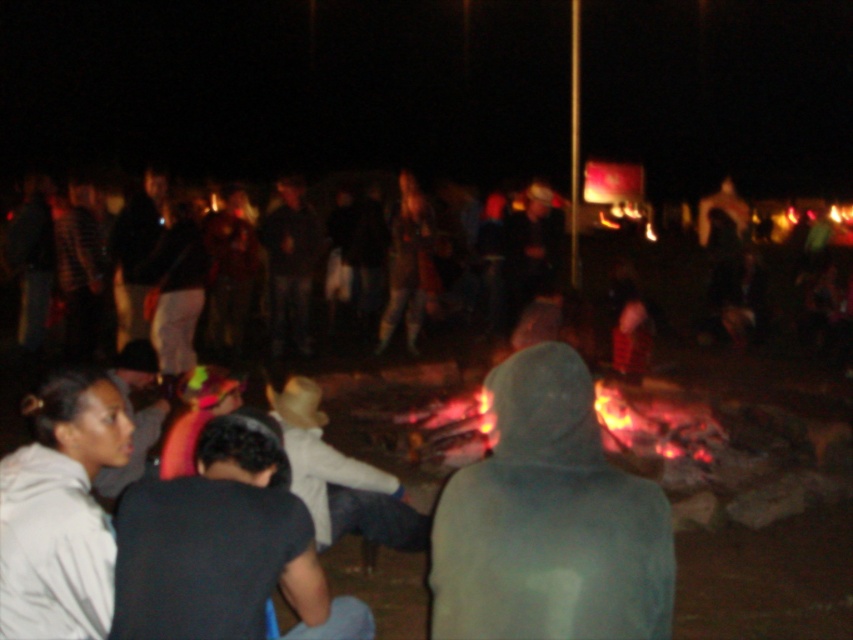
Question: Estimate the real-world distances between objects in this image. Which object is farther from the black cotton shirt at lower left?

Choices:
 (A) dark gray hoodie at center
 (B) dark blue jeans at center
 (C) light gray cotton shirt at center

Answer: (B)

Question: Can you confirm if light gray cotton shirt at center is positioned to the left of dark gray hoodie at center?

Choices:
 (A) yes
 (B) no

Answer: (B)

Question: Considering the real-world distances, which object is farthest from the black cotton shirt at lower left?

Choices:
 (A) gray fleece hoodie at center
 (B) gray hoodie at lower left

Answer: (A)

Question: Can you confirm if black cotton shirt at lower left is thinner than gray hoodie at lower left?

Choices:
 (A) no
 (B) yes

Answer: (A)

Question: Which point is farther to the camera?

Choices:
 (A) (299, 339)
 (B) (560, 490)
 (C) (97, 509)
 (D) (357, 529)

Answer: (A)

Question: Can you confirm if light gray cotton shirt at center is positioned to the left of dark gray hoodie at center?

Choices:
 (A) yes
 (B) no

Answer: (B)